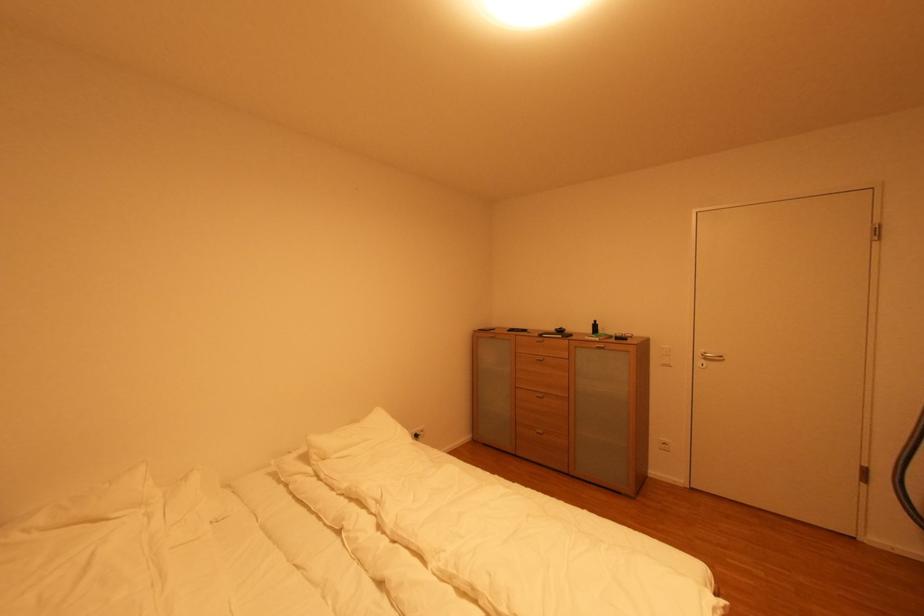
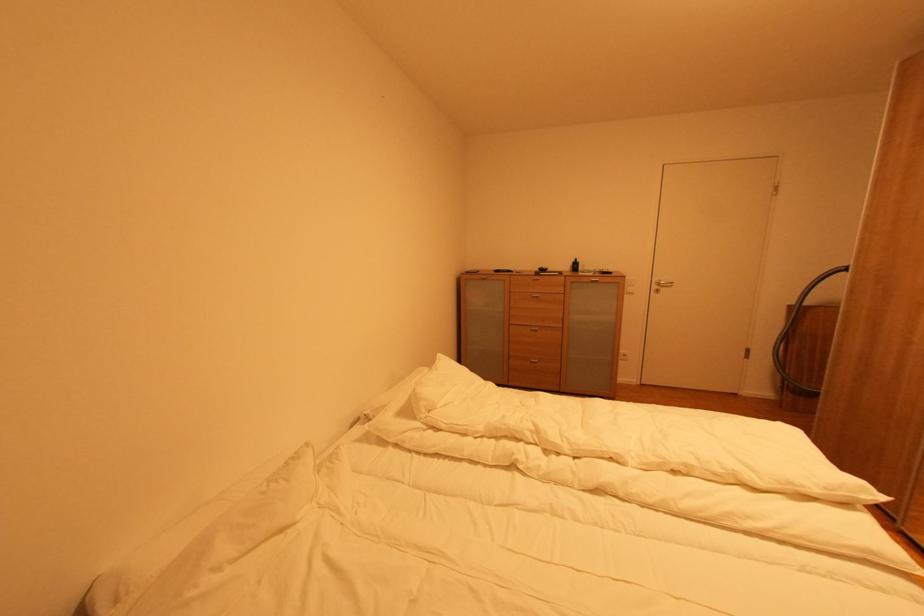
Locate, in the second image, the point that corresponds to (706,362) in the first image.

(661, 289)